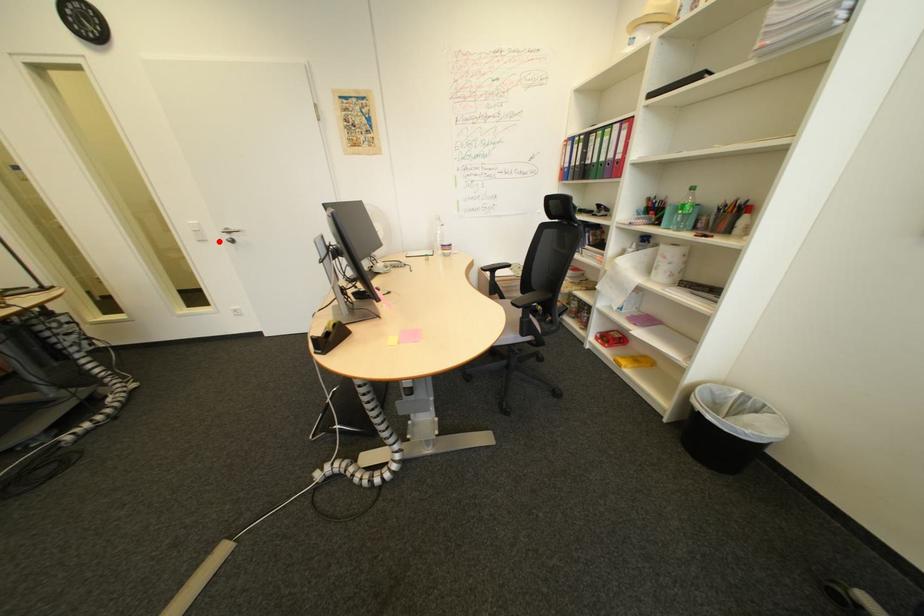
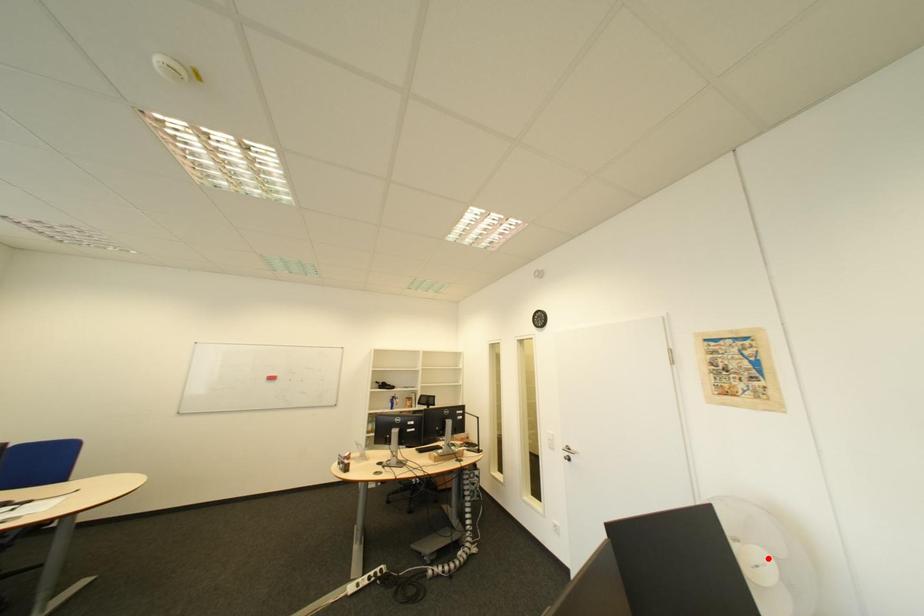
I am providing you with two images of the same scene from different viewpoints. A red point is marked on the first image and another point is marked on the second image. Do the highlighted points in image1 and image2 indicate the same real-world spot?

No